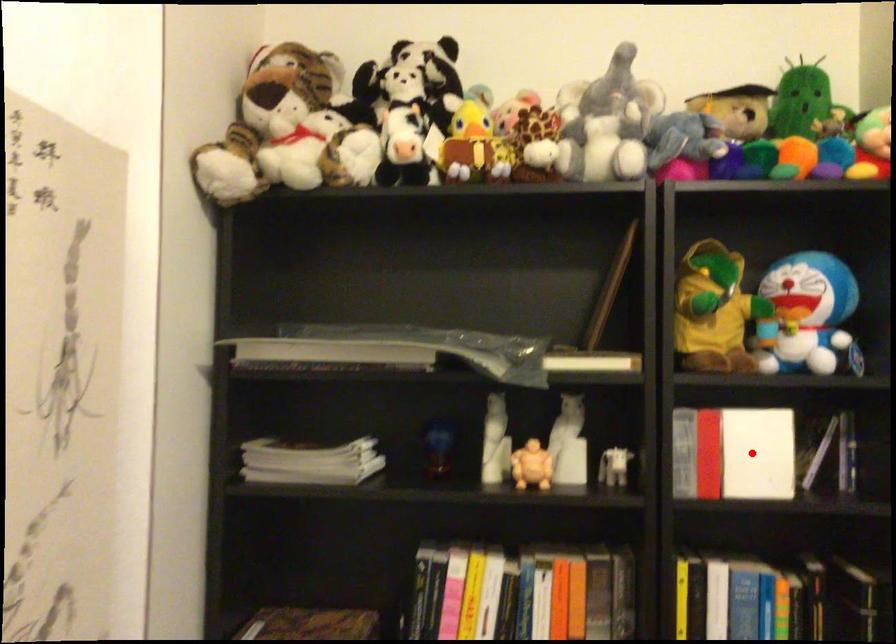
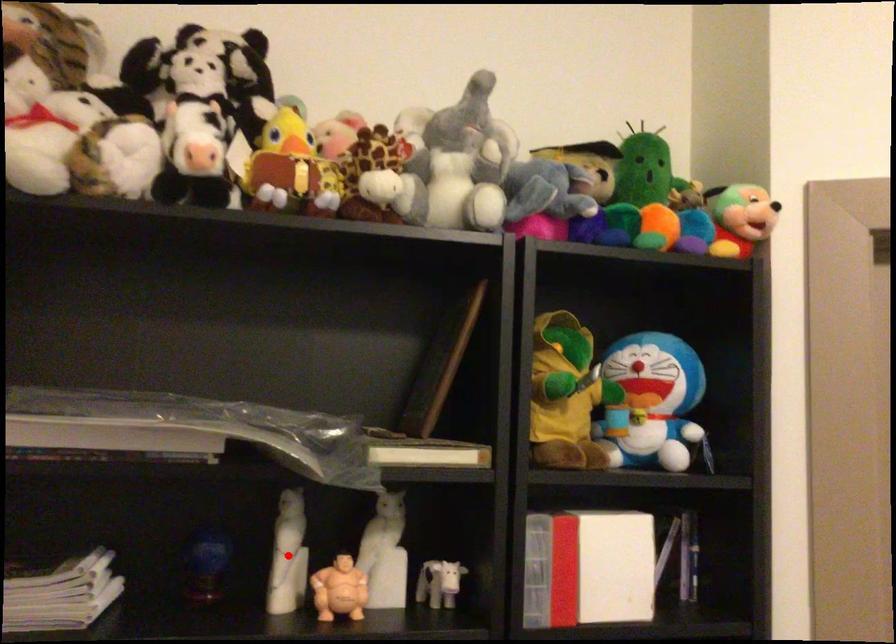
I am providing you with two images of the same scene from different viewpoints. A red point is marked on the first image and another point is marked on the second image. Are the points marked in image1 and image2 representing the same 3D position?

No